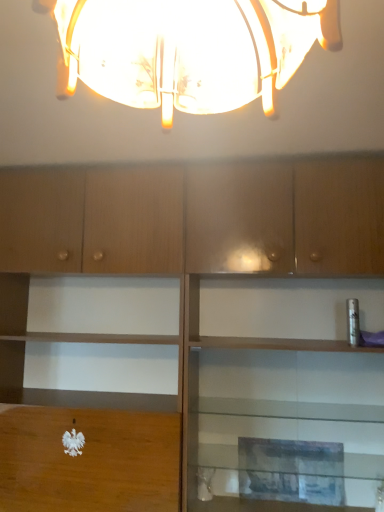
Question: Considering their positions, is translucent glass lampshade at upper center located in front of or behind wooden cabinet at center?

Choices:
 (A) front
 (B) behind

Answer: (A)

Question: Is translucent glass lampshade at upper center inside the boundaries of wooden cabinet at center, or outside?

Choices:
 (A) outside
 (B) inside

Answer: (A)

Question: Is point (253, 93) closer or farther from the camera than point (339, 238)?

Choices:
 (A) farther
 (B) closer

Answer: (B)

Question: In the image, is wooden cabinet at center on the left side or the right side of translucent glass lampshade at upper center?

Choices:
 (A) right
 (B) left

Answer: (A)

Question: Relative to translucent glass lampshade at upper center, is wooden cabinet at center in front or behind?

Choices:
 (A) front
 (B) behind

Answer: (B)

Question: Considering the positions of point (382, 237) and point (286, 33), is point (382, 237) closer or farther from the camera than point (286, 33)?

Choices:
 (A) farther
 (B) closer

Answer: (A)

Question: From their relative heights in the image, would you say wooden cabinet at center is taller or shorter than translucent glass lampshade at upper center?

Choices:
 (A) tall
 (B) short

Answer: (A)